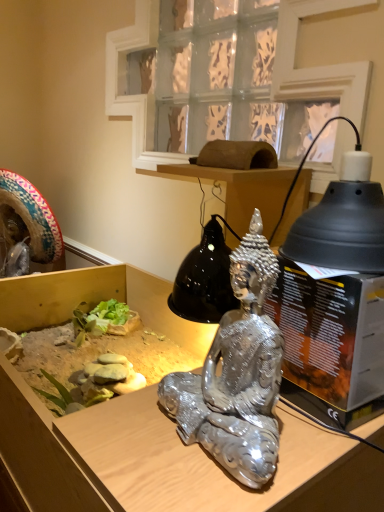
Question: Should I look upward or downward to see metallic statue at center?

Choices:
 (A) up
 (B) down

Answer: (B)

Question: Does black matte lampshade at upper right contain metallic statue at center?

Choices:
 (A) yes
 (B) no

Answer: (B)

Question: Considering the relative sizes of black matte lampshade at upper right and metallic statue at center in the image provided, is black matte lampshade at upper right shorter than metallic statue at center?

Choices:
 (A) yes
 (B) no

Answer: (A)

Question: From a real-world perspective, is black matte lampshade at upper right over metallic statue at center?

Choices:
 (A) yes
 (B) no

Answer: (A)

Question: From a real-world perspective, is black matte lampshade at upper right located beneath metallic statue at center?

Choices:
 (A) no
 (B) yes

Answer: (A)

Question: Is black matte lampshade at upper right thinner than metallic statue at center?

Choices:
 (A) no
 (B) yes

Answer: (B)

Question: Does black matte lampshade at upper right touch metallic statue at center?

Choices:
 (A) yes
 (B) no

Answer: (B)

Question: Can you confirm if metallic statue at center is thinner than clear glass window at upper center?

Choices:
 (A) no
 (B) yes

Answer: (A)

Question: Is metallic statue at center further to the viewer compared to clear glass window at upper center?

Choices:
 (A) no
 (B) yes

Answer: (A)

Question: Is metallic statue at center smaller than clear glass window at upper center?

Choices:
 (A) yes
 (B) no

Answer: (B)

Question: Is metallic statue at center far away from clear glass window at upper center?

Choices:
 (A) yes
 (B) no

Answer: (A)

Question: Does metallic statue at center come in front of clear glass window at upper center?

Choices:
 (A) yes
 (B) no

Answer: (A)

Question: Can you confirm if metallic statue at center is bigger than clear glass window at upper center?

Choices:
 (A) no
 (B) yes

Answer: (B)

Question: Can you confirm if clear glass window at upper center is smaller than metallic statue at center?

Choices:
 (A) yes
 (B) no

Answer: (A)